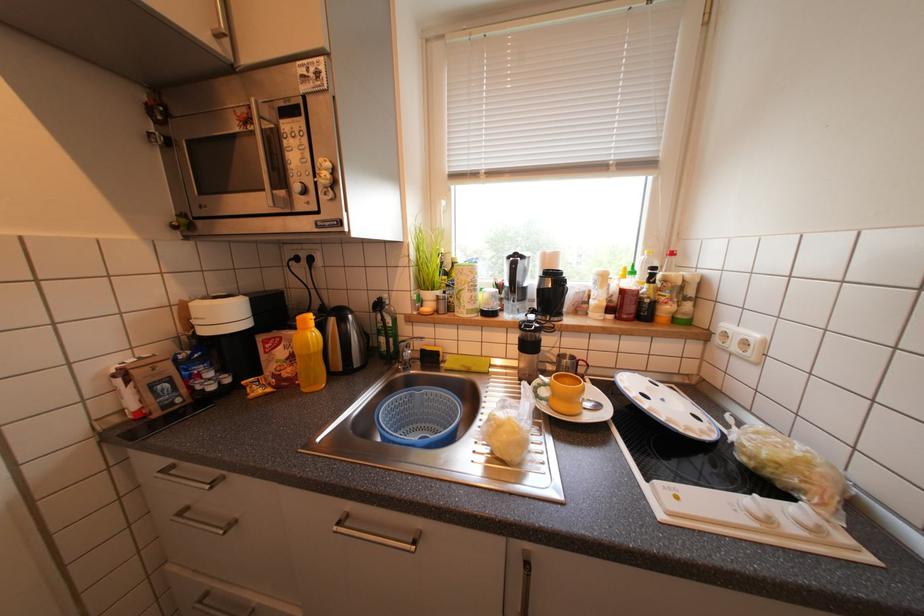
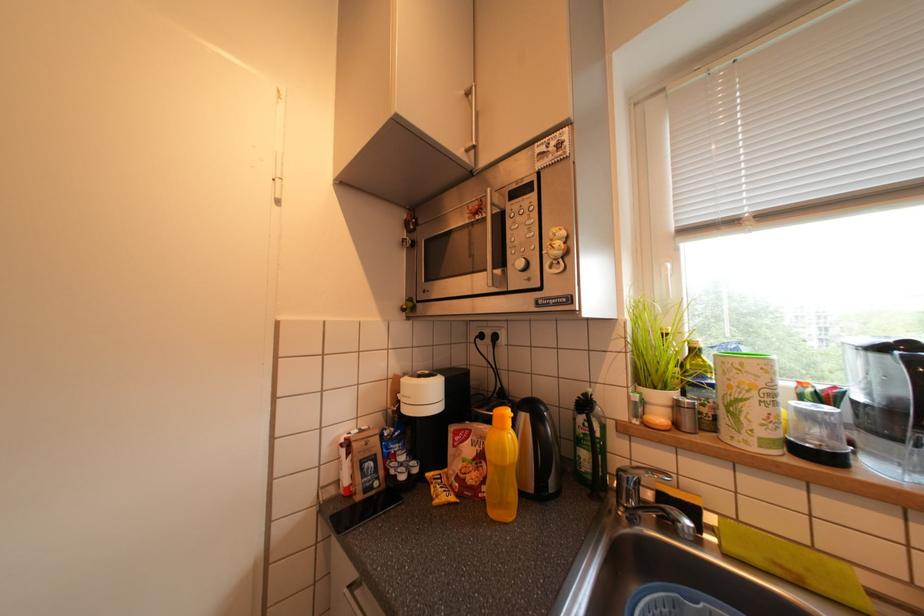
Question: The camera is either moving clockwise (left) or counter-clockwise (right) around the object. The first image is from the beginning of the video and the second image is from the end. Is the camera moving left or right when shooting the video?

Choices:
 (A) Left
 (B) Right

Answer: (B)